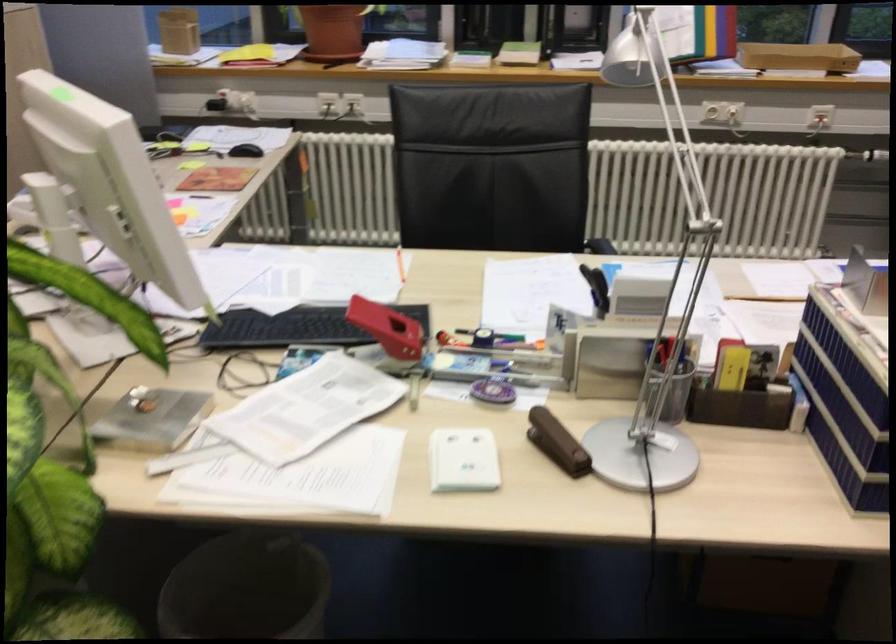
Find where to adjust the silver lamp head. Please return your answer as a coordinate pair (x, y).

(632, 53)